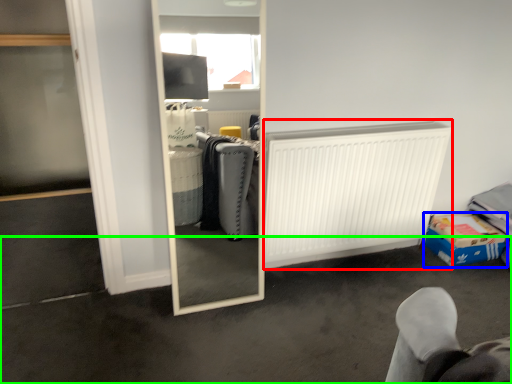
Question: Which object is positioned closest to radiator (highlighted by a red box)? Select from cardboard box (highlighted by a blue box) and concrete (highlighted by a green box).

Choices:
 (A) cardboard box
 (B) concrete

Answer: (B)